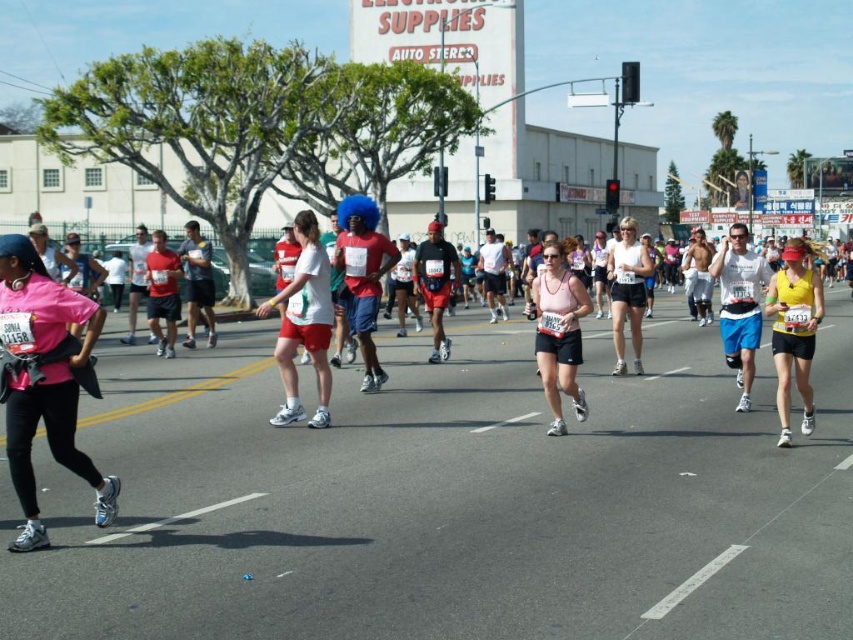
Question: Which of these objects is positioned farthest from the matte pink tank top at center?

Choices:
 (A) pink fabric shorts at center
 (B) pink matte shirt at left
 (C) yellow matte tank top at center
 (D) white matte shorts at center

Answer: (B)

Question: Considering the real-world distances, which object is farthest from the yellow matte tank top at center?

Choices:
 (A) matte pink tank top at center
 (B) white matte shorts at center
 (C) pink fabric shorts at center
 (D) pink matte shirt at left

Answer: (D)

Question: Is the position of white matte shorts at center less distant than that of yellow matte tank top at center?

Choices:
 (A) no
 (B) yes

Answer: (A)

Question: Is yellow matte tank top at center further to the viewer compared to pink fabric shorts at center?

Choices:
 (A) no
 (B) yes

Answer: (A)

Question: Does yellow matte tank top at center have a greater width compared to pink fabric shorts at center?

Choices:
 (A) yes
 (B) no

Answer: (B)

Question: Among these objects, which one is nearest to the camera?

Choices:
 (A) pink matte shirt at left
 (B) white matte shorts at center

Answer: (A)